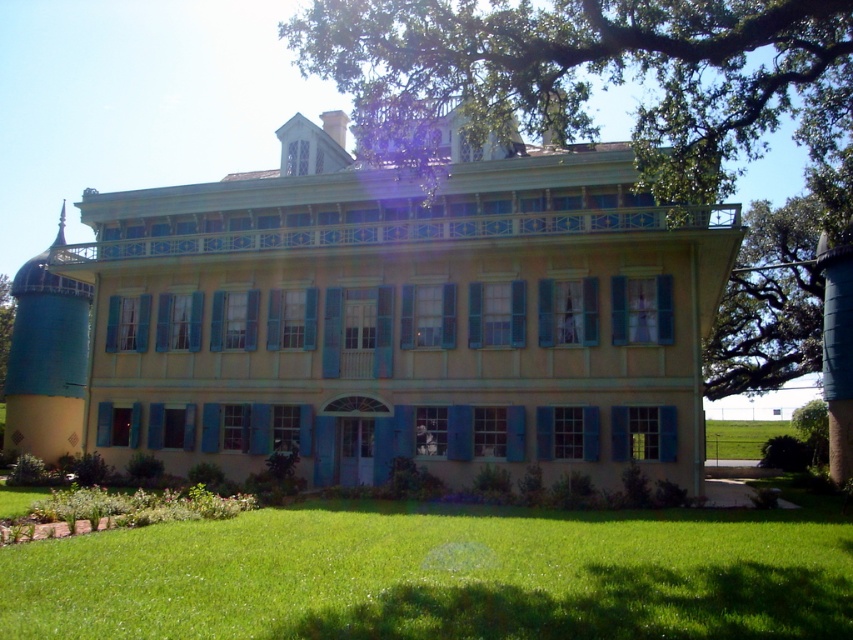
From the picture: You are standing in front of the house and notice two points marked on the facade. The first point is located at coordinates point (387, 19) and the second at point (730, 424). Which of these points is closer to you?

Point (387, 19) is closer to the viewer than point (730, 424).

Consider the image. You are standing in front of the house and want to take a photo. You notice two points marked on the facade. One is at coordinate point (221, 618) and the other at point (465, 17). Which point appears closer to you when looking at the house?

Point (221, 618) is closer to the camera than point (465, 17), so it appears closer when looking at the house.